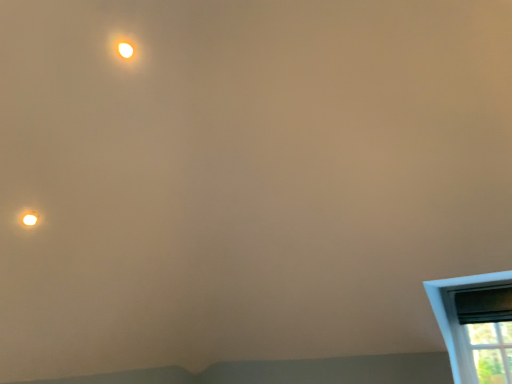
What do you see at coordinates (125, 48) in the screenshot? I see `matte white light at upper left` at bounding box center [125, 48].

Measure the distance between matte white light at upper left and camera.

The depth of matte white light at upper left is 6.76 feet.

Where is `matte white droplight at upper left`? The image size is (512, 384). matte white droplight at upper left is located at coordinates (29, 219).

The width and height of the screenshot is (512, 384). Identify the location of matte white light at upper left. (125, 48).

Is black plastic window screen at lower right smaller than matte white droplight at upper left?

No.

How much distance is there between black plastic window screen at lower right and matte white droplight at upper left?

black plastic window screen at lower right is 10.17 feet away from matte white droplight at upper left.

Does point (489, 317) appear closer or farther from the camera than point (27, 216)?

Point (489, 317) appears to be farther away from the viewer than point (27, 216).

From a real-world perspective, does black plastic window screen at lower right stand above matte white droplight at upper left?

No, from a real-world perspective, black plastic window screen at lower right is not on top of matte white droplight at upper left.

Is matte white light at upper left not near matte white droplight at upper left?

matte white light at upper left is actually quite close to matte white droplight at upper left.

Which of these two, matte white light at upper left or matte white droplight at upper left, stands shorter?

matte white droplight at upper left.

Can you confirm if matte white light at upper left is positioned to the right of matte white droplight at upper left?

Indeed, matte white light at upper left is positioned on the right side of matte white droplight at upper left.

Is matte white light at upper left oriented away from matte white droplight at upper left?

matte white light at upper left is not turned away from matte white droplight at upper left.

Based on the photo, is black plastic window screen at lower right inside or outside of matte white light at upper left?

black plastic window screen at lower right cannot be found inside matte white light at upper left.

Is black plastic window screen at lower right placed right next to matte white light at upper left?

No, black plastic window screen at lower right is not in contact with matte white light at upper left.

Consider the image. Between matte white light at upper left and black plastic window screen at lower right, which one is positioned behind?

black plastic window screen at lower right is further away from the camera.

From a real-world perspective, is matte white light at upper left positioned above or below black plastic window screen at lower right?

In terms of real-world spatial position, matte white light at upper left is above black plastic window screen at lower right.

Which is behind, point (134, 52) or point (480, 316)?

The point (480, 316) is farther.

Considering the relative positions of matte white light at upper left and black plastic window screen at lower right in the image provided, is matte white light at upper left to the left or to the right of black plastic window screen at lower right?

In the image, matte white light at upper left appears on the left side of black plastic window screen at lower right.

Which is more distant, (29, 211) or (490, 297)?

The point (490, 297) is farther from the camera.

Is matte white droplight at upper left bigger than black plastic window screen at lower right?

No.

In terms of height, does matte white droplight at upper left look taller or shorter compared to black plastic window screen at lower right?

matte white droplight at upper left is shorter than black plastic window screen at lower right.

Is matte white droplight at upper left closer to the viewer compared to black plastic window screen at lower right?

Yes, it is.

In terms of height, does matte white droplight at upper left look taller or shorter compared to matte white light at upper left?

matte white droplight at upper left is shorter than matte white light at upper left.

Is matte white light at upper left at the back of matte white droplight at upper left?

matte white droplight at upper left does not have its back to matte white light at upper left.

In the image, is matte white droplight at upper left on the left side or the right side of matte white light at upper left?

Based on their positions, matte white droplight at upper left is located to the left of matte white light at upper left.

Where is `droplight above the black plastic window screen at lower right (from a real-world perspective)`? This screenshot has height=384, width=512. droplight above the black plastic window screen at lower right (from a real-world perspective) is located at coordinates (29, 219).

The height and width of the screenshot is (384, 512). Identify the location of light that is above the matte white droplight at upper left (from the image's perspective). (125, 48).

Looking at this image, which object lies further to the anchor point matte white droplight at upper left, matte white light at upper left or black plastic window screen at lower right?

The object further to matte white droplight at upper left is black plastic window screen at lower right.

From the image, which object appears to be nearer to matte white light at upper left, black plastic window screen at lower right or matte white droplight at upper left?

matte white droplight at upper left is closer to matte white light at upper left.

Looking at the image, which one is located further to matte white light at upper left, matte white droplight at upper left or black plastic window screen at lower right?

Based on the image, black plastic window screen at lower right appears to be further to matte white light at upper left.

From the image, which object appears to be nearer to black plastic window screen at lower right, matte white droplight at upper left or matte white light at upper left?

matte white light at upper left is positioned closer to the anchor black plastic window screen at lower right.

When comparing their distances from black plastic window screen at lower right, does matte white light at upper left or matte white droplight at upper left seem closer?

Among the two, matte white light at upper left is located nearer to black plastic window screen at lower right.

Estimate the real-world distances between objects in this image. Which object is closer to matte white droplight at upper left, black plastic window screen at lower right or matte white light at upper left?

matte white light at upper left is positioned closer to the anchor matte white droplight at upper left.

Image resolution: width=512 pixels, height=384 pixels. Find the location of `light situated between matte white droplight at upper left and black plastic window screen at lower right from left to right`. light situated between matte white droplight at upper left and black plastic window screen at lower right from left to right is located at coordinates (125, 48).